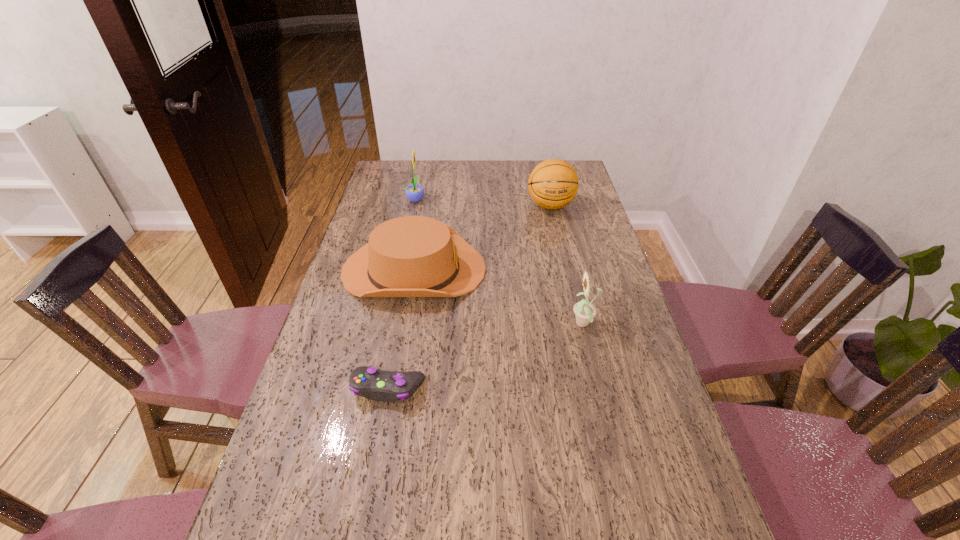
Where is `blank region between the basketball and the control`? This screenshot has width=960, height=540. blank region between the basketball and the control is located at coordinates (469, 297).

The height and width of the screenshot is (540, 960). I want to click on vacant area that lies between the farther sunflower and the fourth farthest object, so click(500, 262).

Locate an element on the screen. The image size is (960, 540). object that is the fourth nearest to the nearer sunflower is located at coordinates (414, 192).

At what (x,y) coordinates should I click in order to perform the action: click on object that can be found as the fourth closest to the left sunflower. Please return your answer as a coordinate pair (x, y). This screenshot has width=960, height=540. Looking at the image, I should click on (387, 386).

Where is `free space that satisfies the following two spatial constraints: 1. on the back side of the shortest object; 2. on the front-facing side of the farther sunflower`? free space that satisfies the following two spatial constraints: 1. on the back side of the shortest object; 2. on the front-facing side of the farther sunflower is located at coordinates (423, 199).

You are a GUI agent. You are given a task and a screenshot of the screen. Output one action in this format:
    pyautogui.click(x=<x>, y=<y>)
    Task: Click on the vacant space that satisfies the following two spatial constraints: 1. on the back side of the shortest object; 2. on the front-facing side of the left sunflower
    The image size is (960, 540).
    Given the screenshot: What is the action you would take?
    pyautogui.click(x=423, y=199)

The height and width of the screenshot is (540, 960). I want to click on free point that satisfies the following two spatial constraints: 1. on the surface of the basketball near the brand logo; 2. on the front-facing side of the cowboy hat, so [564, 269].

The width and height of the screenshot is (960, 540). I want to click on free space that satisfies the following two spatial constraints: 1. on the front-facing side of the control; 2. on the right side of the farther sunflower, so click(376, 388).